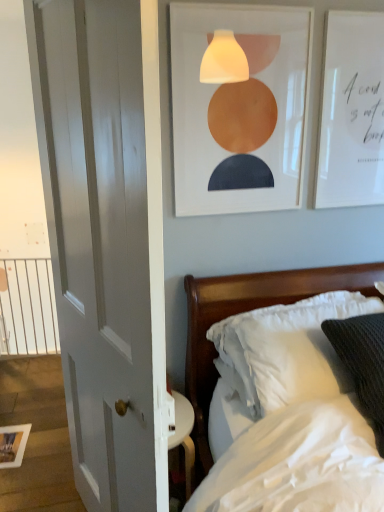
Question: Would you say wooden bed at right contains white paper at upper right, acting as the 1th picture frame starting from the right?

Choices:
 (A) yes
 (B) no

Answer: (B)

Question: Is wooden bed at right positioned far away from white paper at upper right, acting as the 1th picture frame starting from the right?

Choices:
 (A) yes
 (B) no

Answer: (B)

Question: From a real-world perspective, is wooden bed at right on white paper at upper right, acting as the 1th picture frame starting from the right?

Choices:
 (A) no
 (B) yes

Answer: (A)

Question: Could you tell me if wooden bed at right is turned towards white paper at upper right, the 2th picture frame positioned from the front?

Choices:
 (A) yes
 (B) no

Answer: (B)

Question: Does wooden bed at right have a greater width compared to white paper at upper right, which appears as the 3th picture frame when ordered from the bottom?

Choices:
 (A) yes
 (B) no

Answer: (A)

Question: Can you confirm if wooden bed at right is smaller than white paper at upper right, which appears as the 3th picture frame when ordered from the bottom?

Choices:
 (A) yes
 (B) no

Answer: (B)

Question: Does white metal balustrade at left have a lesser width compared to wooden picture frame at lower left, which ranks as the third picture frame in top-to-bottom order?

Choices:
 (A) no
 (B) yes

Answer: (B)

Question: From a real-world perspective, is white metal balustrade at left beneath wooden picture frame at lower left, acting as the third picture frame starting from the right?

Choices:
 (A) no
 (B) yes

Answer: (A)

Question: From the image's perspective, is white metal balustrade at left beneath wooden picture frame at lower left, which ranks as the first picture frame in bottom-to-top order?

Choices:
 (A) no
 (B) yes

Answer: (A)

Question: From the image's perspective, is white metal balustrade at left on wooden picture frame at lower left, acting as the third picture frame starting from the right?

Choices:
 (A) no
 (B) yes

Answer: (B)

Question: Can you confirm if white metal balustrade at left is bigger than wooden picture frame at lower left, the third picture frame viewed from the front?

Choices:
 (A) no
 (B) yes

Answer: (B)

Question: Is the position of white metal balustrade at left more distant than that of wooden picture frame at lower left, which appears as the first picture frame when viewed from the left?

Choices:
 (A) no
 (B) yes

Answer: (B)

Question: Considering the relative sizes of wooden bed at right and white smooth door at left in the image provided, is wooden bed at right wider than white smooth door at left?

Choices:
 (A) no
 (B) yes

Answer: (B)